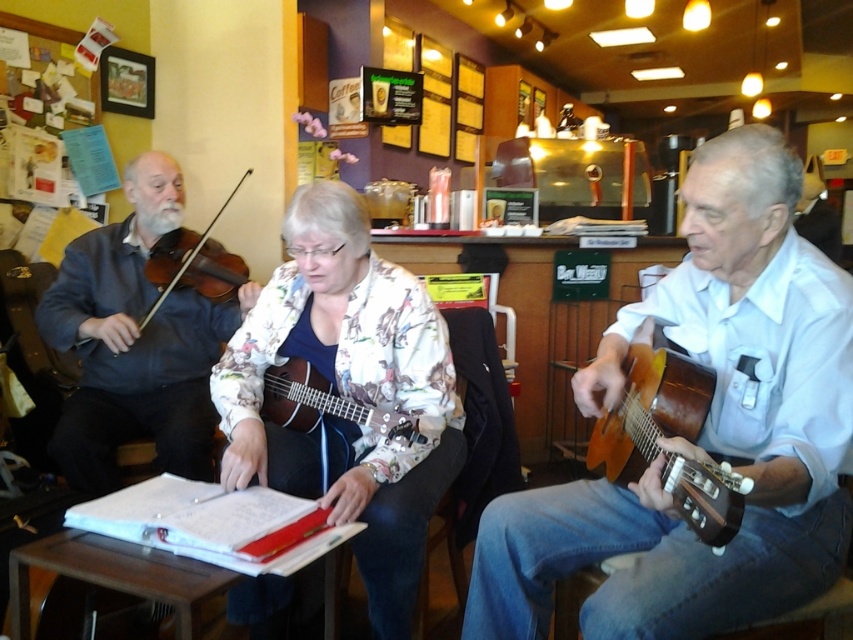
Between shiny brown acoustic guitar at right and matte brown violin at left, which one appears on the right side from the viewer's perspective?

Positioned to the right is shiny brown acoustic guitar at right.

Looking at this image, is shiny brown acoustic guitar at right to the left of matte brown violin at left from the viewer's perspective?

Incorrect, shiny brown acoustic guitar at right is not on the left side of matte brown violin at left.

Locate an element on the screen. The width and height of the screenshot is (853, 640). shiny brown acoustic guitar at right is located at coordinates (668, 436).

Locate an element on the screen. Image resolution: width=853 pixels, height=640 pixels. shiny brown acoustic guitar at right is located at coordinates (668, 436).

Is wooden acoustic guitar at center right smaller than matte brown ukulele at center?

Incorrect, wooden acoustic guitar at center right is not smaller in size than matte brown ukulele at center.

Does wooden acoustic guitar at center right have a lesser width compared to matte brown ukulele at center?

In fact, wooden acoustic guitar at center right might be wider than matte brown ukulele at center.

Find the location of a particular element. Image resolution: width=853 pixels, height=640 pixels. wooden acoustic guitar at center right is located at coordinates (703, 429).

Who is more distant from viewer, (683,508) or (368,406)?

The point (368,406) is more distant.

Based on the photo, between shiny brown acoustic guitar at right and matte brown ukulele at center, which one appears on the right side from the viewer's perspective?

shiny brown acoustic guitar at right is more to the right.

Is point (669, 426) closer to camera compared to point (281, 413)?

Yes, it is in front of point (281, 413).

Where is `shiny brown acoustic guitar at right`? This screenshot has height=640, width=853. shiny brown acoustic guitar at right is located at coordinates [x=668, y=436].